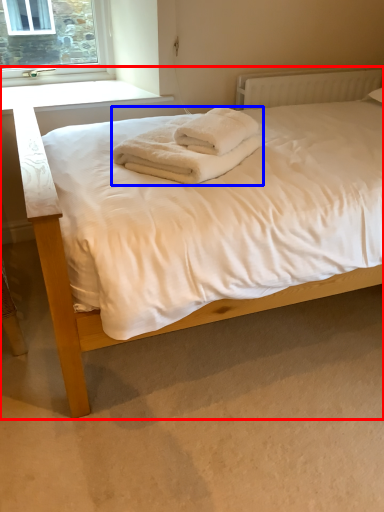
Question: Which object is further to the camera taking this photo, bed (highlighted by a red box) or bath towel (highlighted by a blue box)?

Choices:
 (A) bed
 (B) bath towel

Answer: (B)